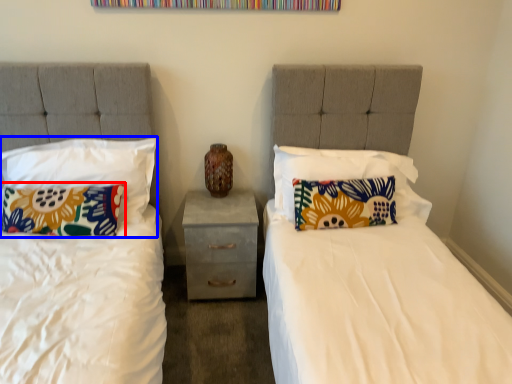
Question: Among these objects, which one is nearest to the camera, pillow (highlighted by a red box) or pillow (highlighted by a blue box)?

Choices:
 (A) pillow
 (B) pillow

Answer: (B)